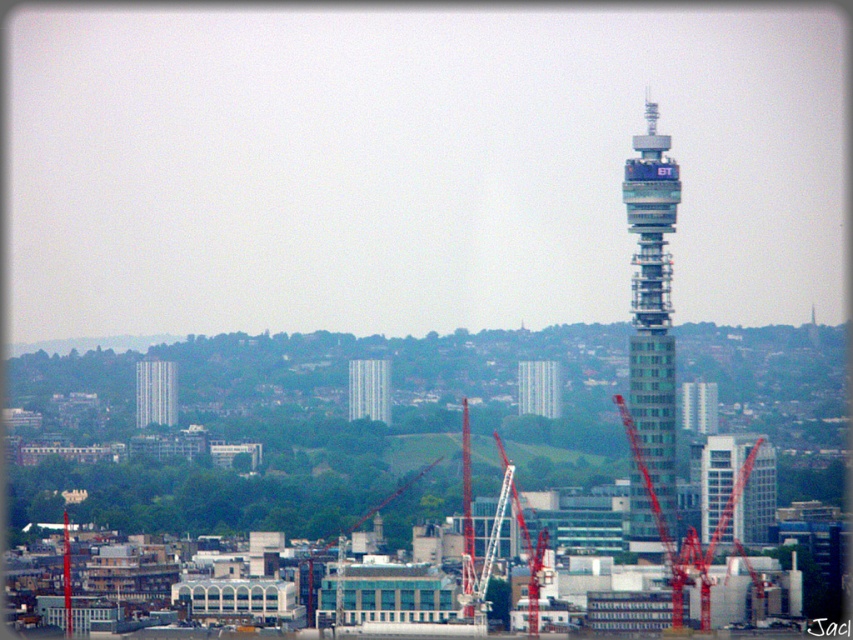
Question: Does silver metallic bt tower at right have a larger size compared to metallic silver tower at center?

Choices:
 (A) yes
 (B) no

Answer: (A)

Question: Which of the following is the farthest from the observer?

Choices:
 (A) (144, 403)
 (B) (642, 180)

Answer: (A)

Question: Which object appears closest to the camera in this image?

Choices:
 (A) white metal crane at center
 (B) red metal crane at center

Answer: (A)

Question: Which object is the closest to the silver metallic bt tower at right?

Choices:
 (A) matte glass tower at center
 (B) red metal crane at center

Answer: (A)

Question: Does white metal crane at center lie in front of white glass building at center?

Choices:
 (A) yes
 (B) no

Answer: (A)

Question: Is silver metallic bt tower at right to the right of matte glass tower at center from the viewer's perspective?

Choices:
 (A) yes
 (B) no

Answer: (B)